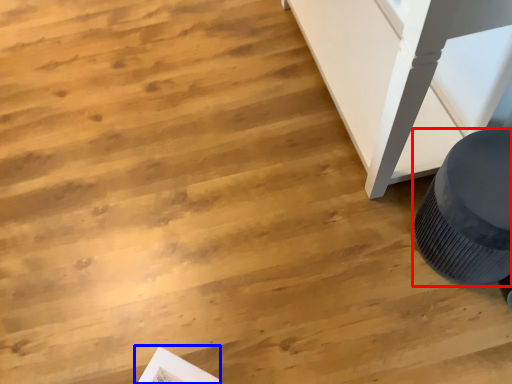
Question: Which of the following is the farthest to the observer, furniture (highlighted by a red box) or magazine (highlighted by a blue box)?

Choices:
 (A) furniture
 (B) magazine

Answer: (B)